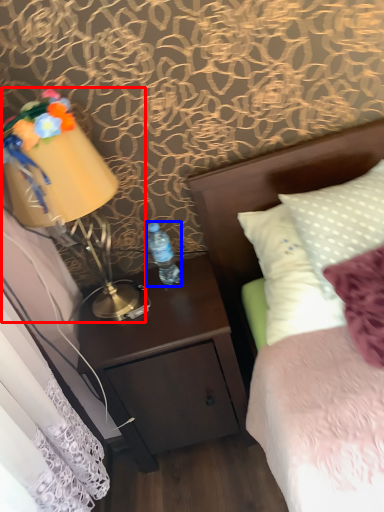
Question: Which point is closer to the camera, bedside lamp (highlighted by a red box) or bottle (highlighted by a blue box)?

Choices:
 (A) bedside lamp
 (B) bottle

Answer: (A)